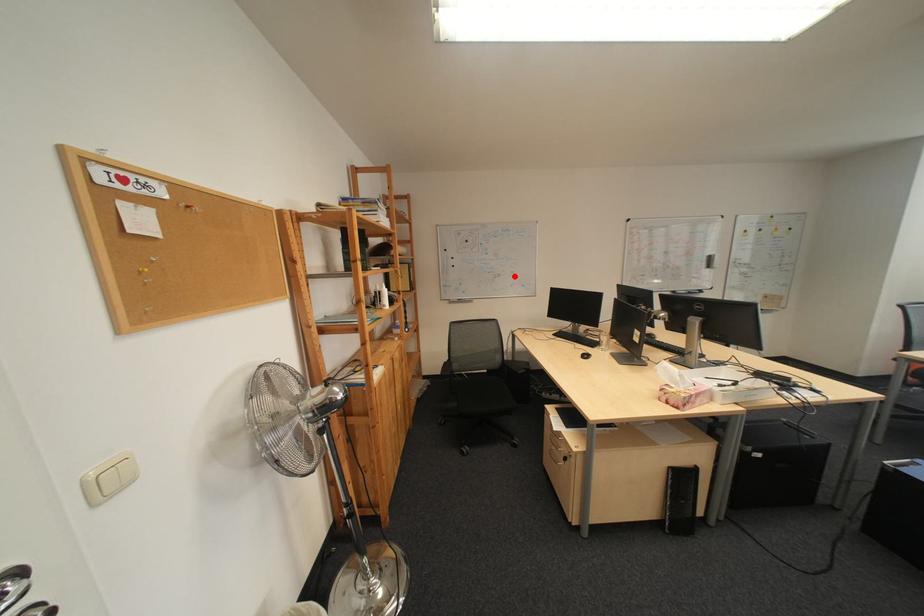
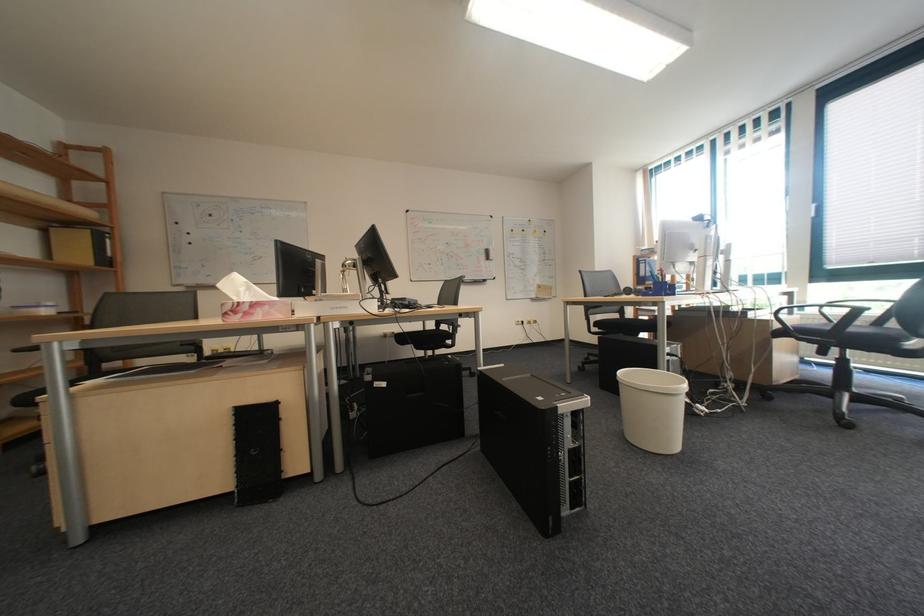
Question: I am providing you with two images of the same scene from different viewpoints. Given a red point in image1, look at the same physical point in image2. Is it:

Choices:
 (A) Closer to the viewpoint
 (B) Farther from the viewpoint

Answer: (A)